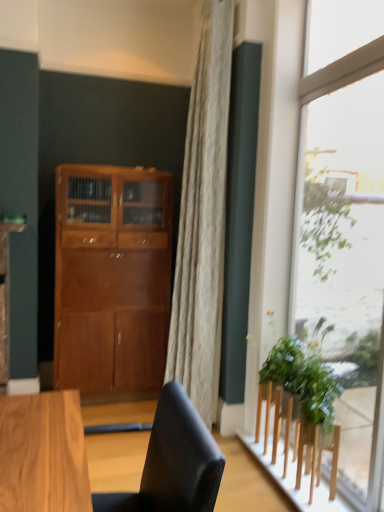
Question: Does wooden stool at lower right have a smaller size compared to green leafy plant at right?

Choices:
 (A) no
 (B) yes

Answer: (A)

Question: Is wooden stool at lower right positioned in front of green leafy plant at right?

Choices:
 (A) yes
 (B) no

Answer: (A)

Question: Could you tell me if wooden stool at lower right is facing green leafy plant at right?

Choices:
 (A) yes
 (B) no

Answer: (B)

Question: Can you confirm if wooden stool at lower right is bigger than green leafy plant at right?

Choices:
 (A) yes
 (B) no

Answer: (A)

Question: From the image's perspective, is wooden stool at lower right over green leafy plant at right?

Choices:
 (A) yes
 (B) no

Answer: (B)

Question: Is wooden stool at lower right not within green leafy plant at right?

Choices:
 (A) yes
 (B) no

Answer: (A)

Question: Can you confirm if matte black chair at lower center is positioned to the left of green leafy plant at right?

Choices:
 (A) yes
 (B) no

Answer: (A)

Question: From a real-world perspective, is matte black chair at lower center over green leafy plant at right?

Choices:
 (A) no
 (B) yes

Answer: (B)

Question: Can we say matte black chair at lower center lies outside green leafy plant at right?

Choices:
 (A) no
 (B) yes

Answer: (B)

Question: Would you consider matte black chair at lower center to be distant from green leafy plant at right?

Choices:
 (A) yes
 (B) no

Answer: (A)

Question: From a real-world perspective, is matte black chair at lower center physically below green leafy plant at right?

Choices:
 (A) no
 (B) yes

Answer: (A)

Question: Can you confirm if matte black chair at lower center is smaller than green leafy plant at right?

Choices:
 (A) yes
 (B) no

Answer: (B)

Question: Is matte wood cabinet at center taller than wooden stool at lower right?

Choices:
 (A) no
 (B) yes

Answer: (B)